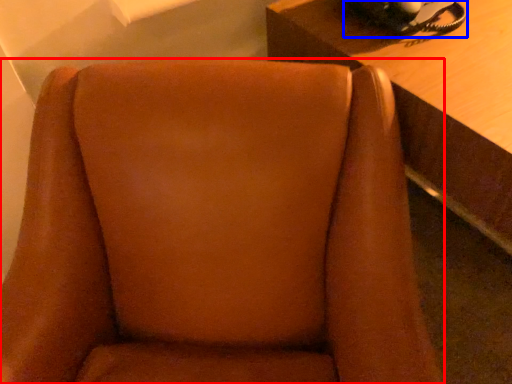
Question: Among these objects, which one is farthest to the camera, chair (highlighted by a red box) or corded phone (highlighted by a blue box)?

Choices:
 (A) chair
 (B) corded phone

Answer: (B)